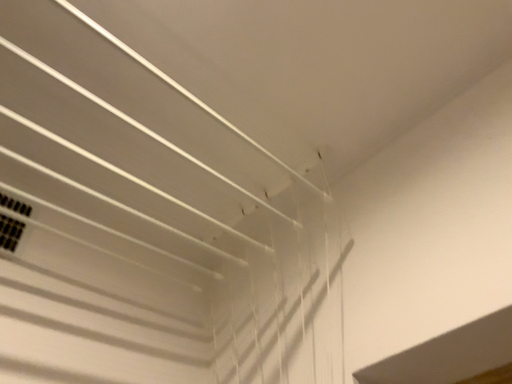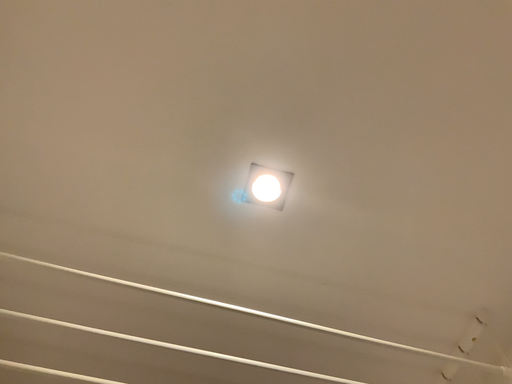
Question: How did the camera likely rotate when shooting the video?

Choices:
 (A) rotated downward
 (B) rotated upward

Answer: (B)